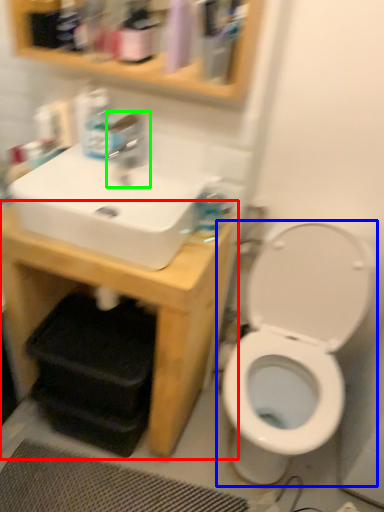
Question: Based on their relative distances, which object is farther from counter (highlighted by a red box)? Choose from toilet (highlighted by a blue box) and tap (highlighted by a green box).

Choices:
 (A) toilet
 (B) tap

Answer: (B)